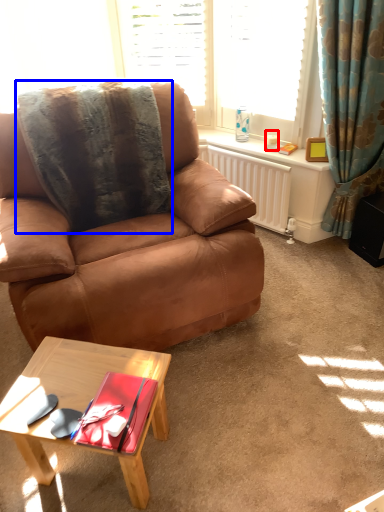
Question: Among these objects, which one is nearest to the camera, coffee cup (highlighted by a red box) or blanket (highlighted by a blue box)?

Choices:
 (A) coffee cup
 (B) blanket

Answer: (B)